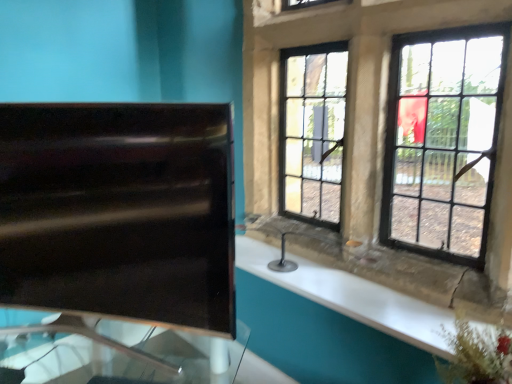
Question: Can you confirm if black glass window at upper right is wider than black glossy sink at left?

Choices:
 (A) yes
 (B) no

Answer: (A)

Question: Is black glass window at upper right shorter than black glossy sink at left?

Choices:
 (A) yes
 (B) no

Answer: (B)

Question: Is black glass window at upper right outside of black glossy sink at left?

Choices:
 (A) yes
 (B) no

Answer: (A)

Question: Can you confirm if black glass window at upper right is taller than black glossy sink at left?

Choices:
 (A) no
 (B) yes

Answer: (B)

Question: Is the depth of black glass window at upper right less than that of black glossy sink at left?

Choices:
 (A) no
 (B) yes

Answer: (B)

Question: Considering the relative positions of black glass window at upper right and black glossy sink at left in the image provided, is black glass window at upper right to the left or to the right of black glossy sink at left?

Choices:
 (A) right
 (B) left

Answer: (A)

Question: From a real-world perspective, is black glass window at upper right positioned above or below black glossy sink at left?

Choices:
 (A) below
 (B) above

Answer: (B)

Question: Considering the positions of black glass window at upper right and black glossy sink at left in the image, is black glass window at upper right wider or thinner than black glossy sink at left?

Choices:
 (A) wide
 (B) thin

Answer: (A)

Question: In terms of size, does black glass window at upper right appear bigger or smaller than black glossy sink at left?

Choices:
 (A) big
 (B) small

Answer: (A)

Question: Does point (400, 301) appear closer or farther from the camera than point (480, 243)?

Choices:
 (A) farther
 (B) closer

Answer: (A)

Question: Is white glossy counter top at right wider or thinner than black glass window at upper right?

Choices:
 (A) wide
 (B) thin

Answer: (A)

Question: Considering their positions, is white glossy counter top at right located in front of or behind black glass window at upper right?

Choices:
 (A) front
 (B) behind

Answer: (B)

Question: Considering the positions of white glossy counter top at right and black glass window at upper right in the image, is white glossy counter top at right bigger or smaller than black glass window at upper right?

Choices:
 (A) big
 (B) small

Answer: (B)

Question: From the image's perspective, is black glossy sink at left positioned above or below white glossy counter top at right?

Choices:
 (A) above
 (B) below

Answer: (A)

Question: Is black glossy sink at left taller or shorter than white glossy counter top at right?

Choices:
 (A) tall
 (B) short

Answer: (A)